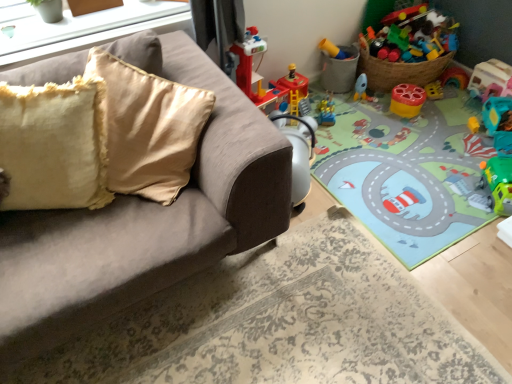
Locate an element on the screen. This screenshot has width=512, height=384. free space to the back side of green plastic toy car at lower right, which is the 4th toy in left-to-right order is located at coordinates (466, 165).